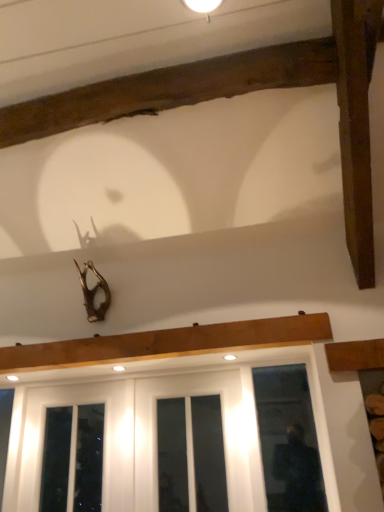
At what (x,y) coordinates should I click in order to perform the action: click on clear glass door at lower right, which appears as the 2th window when viewed from the left. Please return your answer as a coordinate pair (x, y). The width and height of the screenshot is (384, 512). Looking at the image, I should click on (288, 440).

Identify the location of white glossy wood at lower center, which is counted as the 1th window, starting from the left. (156, 423).

What are the coordinates of `light fixture on the right of the white glossy screen door at lower center` in the screenshot? It's located at (203, 6).

From the image's perspective, is white matte light fixture at upper center beneath white glossy screen door at lower center?

No.

From a real-world perspective, is white matte light fixture at upper center on white glossy screen door at lower center?

Yes, from a real-world perspective, white matte light fixture at upper center is on top of white glossy screen door at lower center.

Is white matte light fixture at upper center facing towards white glossy screen door at lower center?

No, white matte light fixture at upper center is not oriented towards white glossy screen door at lower center.

Between point (189, 0) and point (30, 420), which one is positioned in front?

The point (189, 0) is in front.

From the image's perspective, is white matte light fixture at upper center below white glossy wood at lower center, which is counted as the 1th window, starting from the left?

No, from the image's perspective, white matte light fixture at upper center is not beneath white glossy wood at lower center, which is counted as the 1th window, starting from the left.

Could you tell me if white matte light fixture at upper center is turned towards white glossy wood at lower center, which is counted as the 1th window, starting from the left?

No, white matte light fixture at upper center does not turn towards white glossy wood at lower center, which is counted as the 1th window, starting from the left.

Is white matte light fixture at upper center positioned beyond the bounds of white glossy wood at lower center, which is counted as the 1th window, starting from the left?

Yes, white matte light fixture at upper center is not within white glossy wood at lower center, which is counted as the 1th window, starting from the left.

From the image's perspective, is white glossy wood at lower center, which is counted as the 1th window, starting from the left, located above or below white matte light fixture at upper center?

From the image's perspective, white glossy wood at lower center, which is counted as the 1th window, starting from the left, appears below white matte light fixture at upper center.

Does white glossy wood at lower center, which is counted as the 1th window, starting from the left, appear on the left side of white matte light fixture at upper center?

Indeed, white glossy wood at lower center, which is counted as the 1th window, starting from the left, is positioned on the left side of white matte light fixture at upper center.

Identify the location of light fixture on the right of white glossy wood at lower center, which is counted as the 1th window, starting from the left. (203, 6).

Considering the sizes of objects white glossy wood at lower center, which is counted as the 1th window, starting from the left, and white matte light fixture at upper center in the image provided, who is wider, white glossy wood at lower center, which is counted as the 1th window, starting from the left, or white matte light fixture at upper center?

Wider between the two is white matte light fixture at upper center.

Is white glossy wood at lower center, which is counted as the 1th window, starting from the left, positioned before clear glass door at lower right, which appears as the 2th window when viewed from the left?

Yes, white glossy wood at lower center, which is counted as the 1th window, starting from the left, is closer to the viewer.

Is white glossy wood at lower center, which is the 2th window in right-to-left order, far from clear glass door at lower right, which appears as the 2th window when viewed from the left?

No.

Can you confirm if white glossy wood at lower center, which is the 2th window in right-to-left order, is thinner than clear glass door at lower right, positioned as the 1th window in right-to-left order?

In fact, white glossy wood at lower center, which is the 2th window in right-to-left order, might be wider than clear glass door at lower right, positioned as the 1th window in right-to-left order.

Is clear glass door at lower right, positioned as the 1th window in right-to-left order, located within white glossy wood at lower center, which is the 2th window in right-to-left order?

Yes, clear glass door at lower right, positioned as the 1th window in right-to-left order, can be found within white glossy wood at lower center, which is the 2th window in right-to-left order.

Are white glossy screen door at lower center and white glossy wood at lower center, which is counted as the 1th window, starting from the left, beside each other?

white glossy screen door at lower center and white glossy wood at lower center, which is counted as the 1th window, starting from the left, are not in contact.

Considering the sizes of white glossy screen door at lower center and white glossy wood at lower center, which is counted as the 1th window, starting from the left, in the image, is white glossy screen door at lower center taller or shorter than white glossy wood at lower center, which is counted as the 1th window, starting from the left,?

In the image, white glossy screen door at lower center appears to be shorter than white glossy wood at lower center, which is counted as the 1th window, starting from the left.

Is white glossy screen door at lower center aimed at white glossy wood at lower center, which is counted as the 1th window, starting from the left?

Yes.

Considering the sizes of objects white glossy screen door at lower center and white glossy wood at lower center, which is the 2th window in right-to-left order, in the image provided, who is thinner, white glossy screen door at lower center or white glossy wood at lower center, which is the 2th window in right-to-left order,?

white glossy screen door at lower center.

Measure the distance between white glossy screen door at lower center and clear glass door at lower right, which appears as the 2th window when viewed from the left.

They are 12.77 inches apart.

Does white glossy screen door at lower center have a larger size compared to clear glass door at lower right, which appears as the 2th window when viewed from the left?

Indeed, white glossy screen door at lower center has a larger size compared to clear glass door at lower right, which appears as the 2th window when viewed from the left.

Which of these two, white glossy screen door at lower center or clear glass door at lower right, which appears as the 2th window when viewed from the left, stands taller?

With more height is clear glass door at lower right, which appears as the 2th window when viewed from the left.

Can you see white glossy screen door at lower center touching clear glass door at lower right, positioned as the 1th window in right-to-left order?

No, white glossy screen door at lower center is not beside clear glass door at lower right, positioned as the 1th window in right-to-left order.

Could you tell me if clear glass door at lower right, which appears as the 2th window when viewed from the left, is facing white glossy wood at lower center, which is the 2th window in right-to-left order?

Yes, clear glass door at lower right, which appears as the 2th window when viewed from the left, is oriented towards white glossy wood at lower center, which is the 2th window in right-to-left order.

Which object is positioned more to the right, clear glass door at lower right, which appears as the 2th window when viewed from the left, or white glossy wood at lower center, which is counted as the 1th window, starting from the left?

From the viewer's perspective, clear glass door at lower right, which appears as the 2th window when viewed from the left, appears more on the right side.

Does clear glass door at lower right, which appears as the 2th window when viewed from the left, have a smaller size compared to white glossy wood at lower center, which is counted as the 1th window, starting from the left?

Indeed, clear glass door at lower right, which appears as the 2th window when viewed from the left, has a smaller size compared to white glossy wood at lower center, which is counted as the 1th window, starting from the left.

Is clear glass door at lower right, which appears as the 2th window when viewed from the left, inside or outside of white glossy wood at lower center, which is the 2th window in right-to-left order?

clear glass door at lower right, which appears as the 2th window when viewed from the left, can be found inside white glossy wood at lower center, which is the 2th window in right-to-left order.

Where is `screen door that appears below the white matte light fixture at upper center (from a real-world perspective)`? The height and width of the screenshot is (512, 384). screen door that appears below the white matte light fixture at upper center (from a real-world perspective) is located at coordinates tap(156, 426).

This screenshot has height=512, width=384. In order to click on window on the left of white matte light fixture at upper center in this screenshot , I will do `click(156, 423)`.

Estimate the real-world distances between objects in this image. Which object is further from white glossy screen door at lower center, clear glass door at lower right, positioned as the 1th window in right-to-left order, or white glossy wood at lower center, which is counted as the 1th window, starting from the left?

clear glass door at lower right, positioned as the 1th window in right-to-left order, lies further to white glossy screen door at lower center than the other object.

From the image, which object appears to be farther from white glossy wood at lower center, which is the 2th window in right-to-left order, white glossy screen door at lower center or clear glass door at lower right, positioned as the 1th window in right-to-left order?

clear glass door at lower right, positioned as the 1th window in right-to-left order.

When comparing their distances from white glossy screen door at lower center, does white matte light fixture at upper center or clear glass door at lower right, positioned as the 1th window in right-to-left order, seem further?

white matte light fixture at upper center is further to white glossy screen door at lower center.

Looking at the image, which one is located closer to white matte light fixture at upper center, white glossy wood at lower center, which is the 2th window in right-to-left order, or white glossy screen door at lower center?

white glossy screen door at lower center is closer to white matte light fixture at upper center.

Based on their spatial positions, is white glossy screen door at lower center or white glossy wood at lower center, which is counted as the 1th window, starting from the left, closer to clear glass door at lower right, positioned as the 1th window in right-to-left order?

Among the two, white glossy screen door at lower center is located nearer to clear glass door at lower right, positioned as the 1th window in right-to-left order.

Looking at the image, which one is located further to white glossy wood at lower center, which is the 2th window in right-to-left order, white matte light fixture at upper center or clear glass door at lower right, which appears as the 2th window when viewed from the left?

Answer: white matte light fixture at upper center.

Which object lies further to the anchor point white matte light fixture at upper center, white glossy screen door at lower center or clear glass door at lower right, which appears as the 2th window when viewed from the left?

clear glass door at lower right, which appears as the 2th window when viewed from the left, is further to white matte light fixture at upper center.

When comparing their distances from white glossy wood at lower center, which is counted as the 1th window, starting from the left, does white glossy screen door at lower center or white matte light fixture at upper center seem further?

Based on the image, white matte light fixture at upper center appears to be further to white glossy wood at lower center, which is counted as the 1th window, starting from the left.

Where is `window between white matte light fixture at upper center and white glossy screen door at lower center in the vertical direction`? window between white matte light fixture at upper center and white glossy screen door at lower center in the vertical direction is located at coordinates (288, 440).

At what (x,y) coordinates should I click in order to perform the action: click on window between white matte light fixture at upper center and white glossy wood at lower center, which is counted as the 1th window, starting from the left, in the up-down direction. Please return your answer as a coordinate pair (x, y). The image size is (384, 512). Looking at the image, I should click on (288, 440).

At what (x,y) coordinates should I click in order to perform the action: click on screen door between white glossy wood at lower center, which is counted as the 1th window, starting from the left, and clear glass door at lower right, positioned as the 1th window in right-to-left order, in the horizontal direction. Please return your answer as a coordinate pair (x, y). The width and height of the screenshot is (384, 512). Looking at the image, I should click on (156, 426).

Image resolution: width=384 pixels, height=512 pixels. What are the coordinates of `screen door between white matte light fixture at upper center and white glossy wood at lower center, which is the 2th window in right-to-left order, from top to bottom` in the screenshot? It's located at (156, 426).